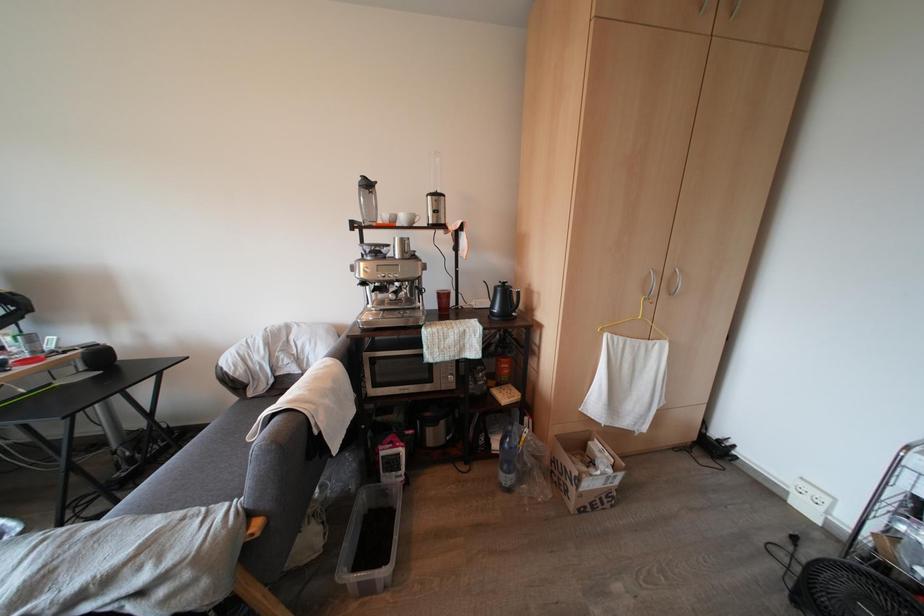
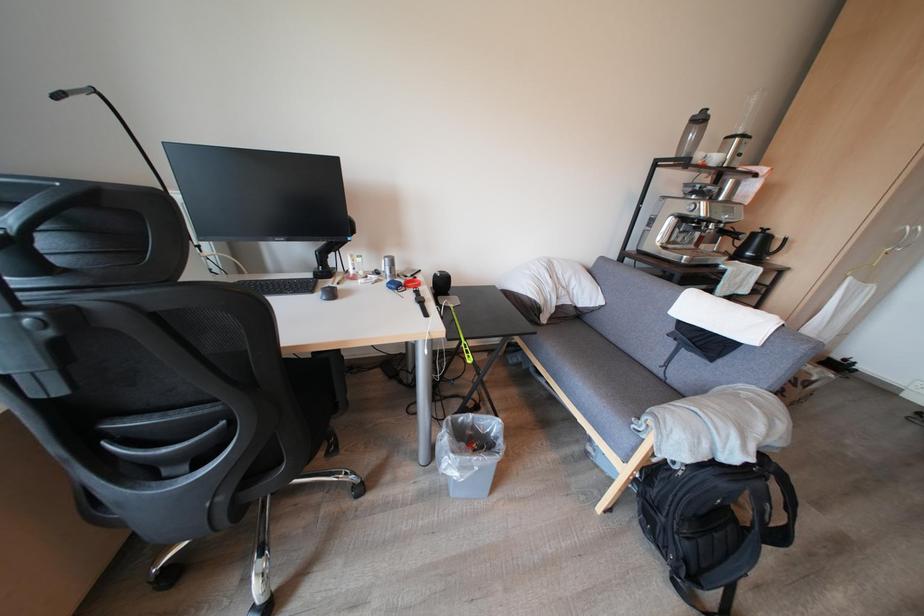
Question: What movement of the cameraman would produce the second image?

Choices:
 (A) Left
 (B) Right
 (C) Forward
 (D) Backward

Answer: (A)